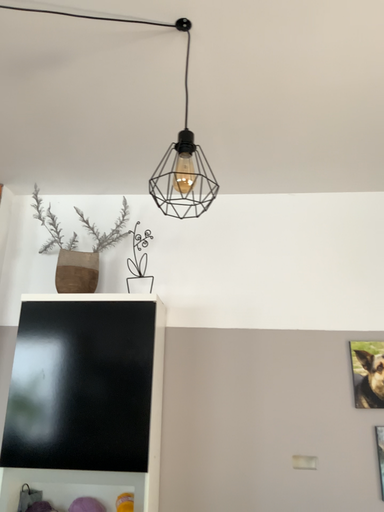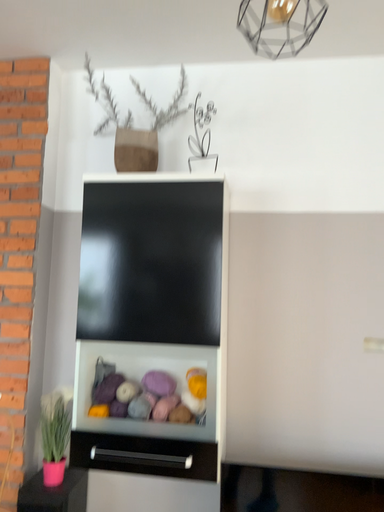
Question: How did the camera likely rotate when shooting the video?

Choices:
 (A) rotated upward
 (B) rotated downward

Answer: (B)